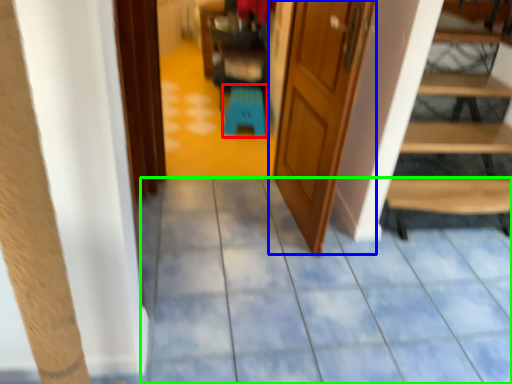
Question: Which object is the closest to the stool (highlighted by a red box)? Choose among these: door (highlighted by a blue box) or path (highlighted by a green box).

Choices:
 (A) door
 (B) path

Answer: (A)